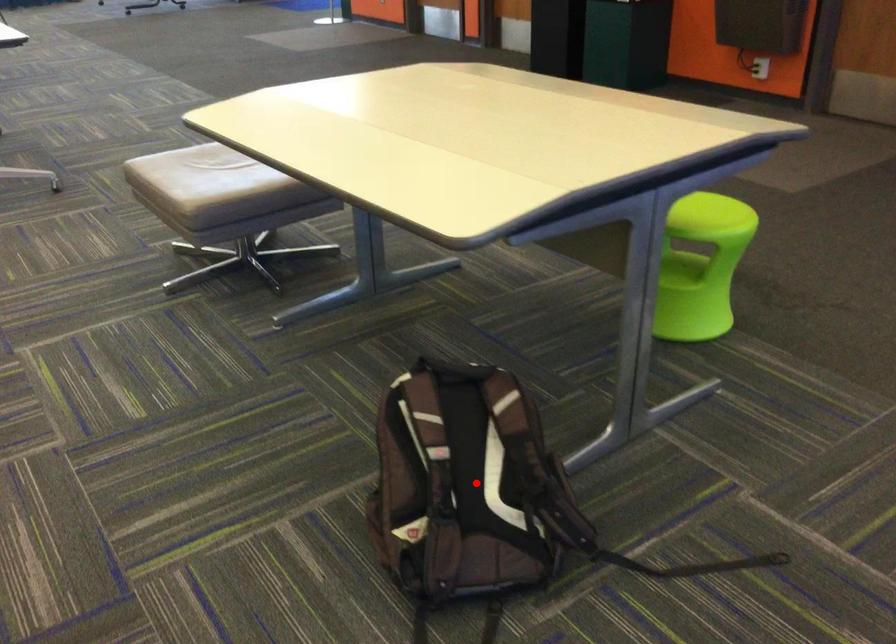
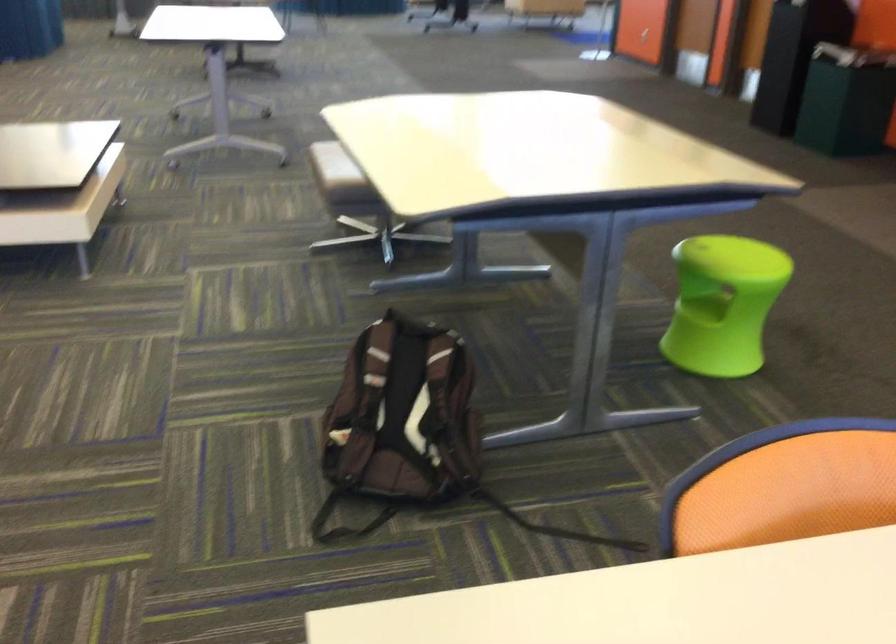
Question: I am providing you with two images of the same scene from different viewpoints. Image1 has a red point marked. In image2, the corresponding 3D location appears at what relative position? Reply with the corresponding letter.

Choices:
 (A) Closer
 (B) Farther

Answer: (B)